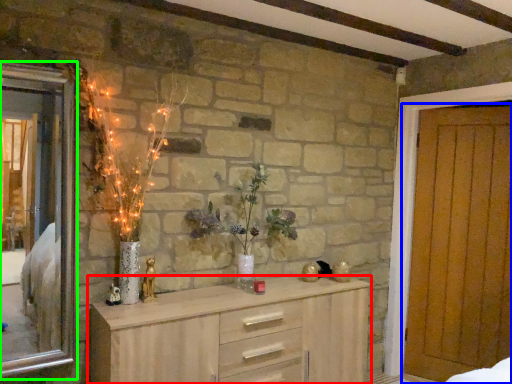
Question: Considering the real-world distances, which object is farthest from chest of drawers (highlighted by a red box)? door (highlighted by a blue box) or window (highlighted by a green box)?

Choices:
 (A) door
 (B) window

Answer: (B)